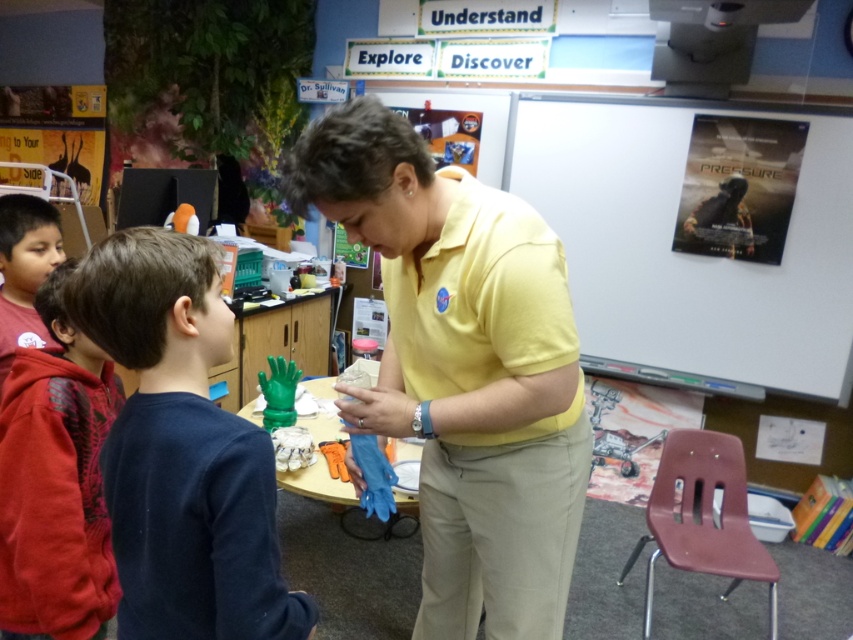
You are a student in the classroom and want to describe the clothing of the woman in the scene. Which item of clothing is positioned lower on her body between the yellow smooth shirt at center and the dark blue sweater at center?

The yellow smooth shirt at center is located below the dark blue sweater at center, so it is positioned lower on her body.

In the scene shown: You are a student sitting at the desk in the classroom. You want to look at the white matte poster at upper right but you have to look over the dark blue sweater at center. Is the poster above or below the sweater?

The white matte poster at upper right is located above the dark blue sweater at center, so the poster is above the sweater.